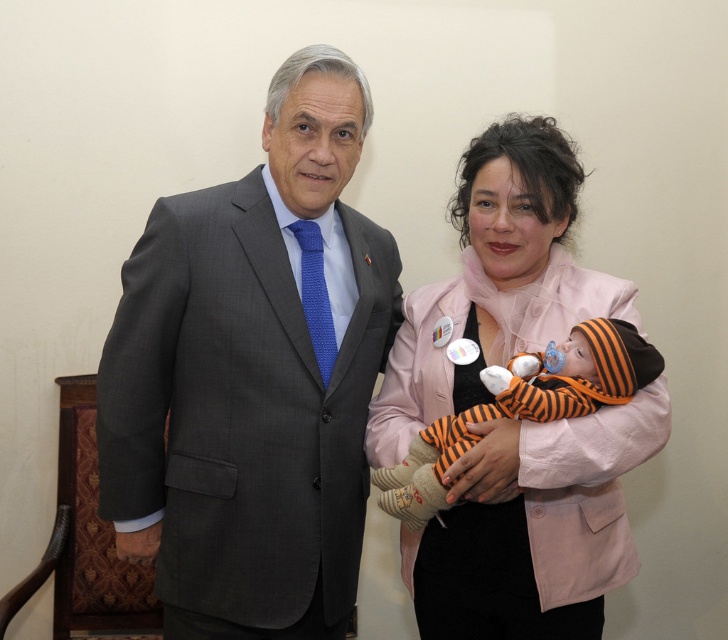
You are a photographer setting up for a group photo. You need to ensure that the matte gray suit at left and the pink fabric baby at center are both clearly visible in the frame. Considering their heights, which object should you adjust the camera angle to focus on first?

The matte gray suit at left is taller than the pink fabric baby at center. Therefore, you should first adjust the camera angle to focus on the pink fabric baby at center to ensure its visibility, as it is shorter and might be partially obscured if the camera is set to the taller object.

You are a photographer adjusting the camera focus. The pink fabric baby at center and the blue knitted tie at center are both in the frame. Which object should you focus on first if you want to ensure the taller one is sharp?

The pink fabric baby at center is taller than the blue knitted tie at center, so you should focus on the pink fabric baby at center first.